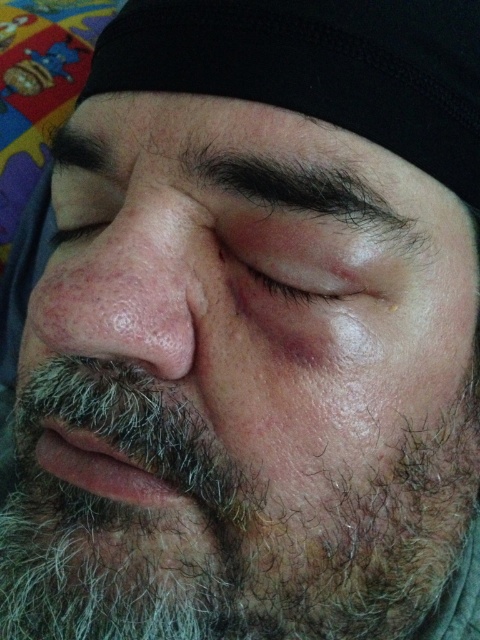
You are a medical professional examining a patient. You see a point at coordinates point (67, 412) on their face. The standard distance for a medical examination is 16 inches. Can you safely examine this point without moving closer?

The distance of point (67, 412) from viewer is 15.24 inches, which is slightly less than the standard 16 inches. Therefore, you need to move back slightly to maintain the recommended distance during the examination.

You are a medical professional assessing the distance between a patient and a specific point on their face. The point is located at coordinates point [197,180]. If the patient is sitting 36.86 centimeters away from you, can you reach that point with your stethoscope which has a 30 cm long tube?

The point [197,180] is 36.86 centimeters away from the viewer. Since the stethoscope tube is only 30 cm long, it is not long enough to reach the point from that distance.

You are a dermatologist examining a patient. You notice the dark brown hair at upper center and the dry skin at center. How far apart are these two features on the patient?

The dark brown hair at upper center is 2.41 inches from the dry skin at center.